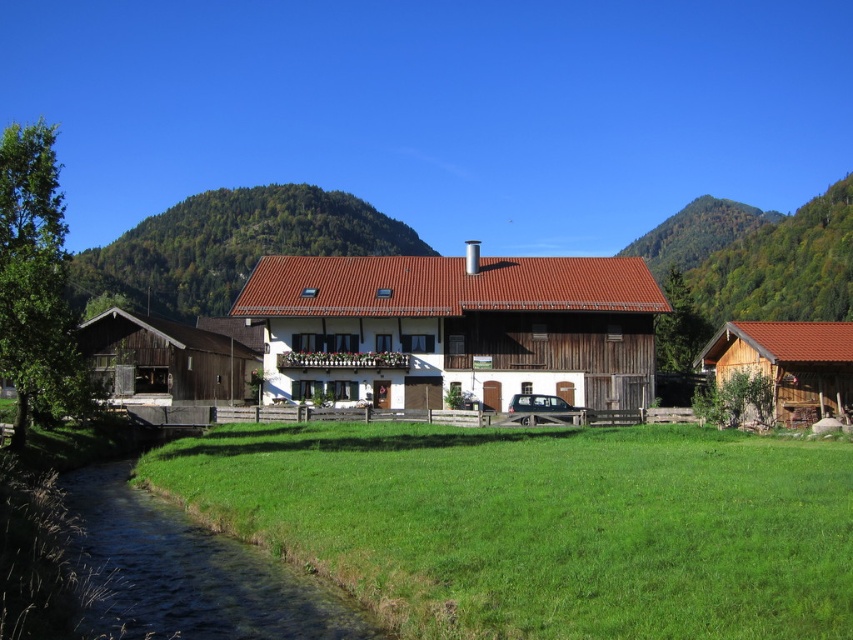
In the scene shown: You are planning to build a small garden between the white wooden house at center and the clear water at lower left. Given the spatial relationship between these two objects, which one has a greater horizontal extent, and how does this affect your garden design?

The white wooden house at center has a greater horizontal extent than the clear water at lower left. This means the garden should be designed closer to the water to maximize space adjacent to the house while ensuring it doesn not encroach on the water area.